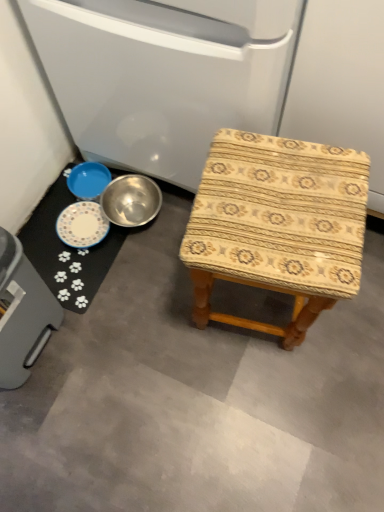
This screenshot has height=512, width=384. What are the coordinates of `free space in front of white paw print mat at lower left` in the screenshot? It's located at (109, 346).